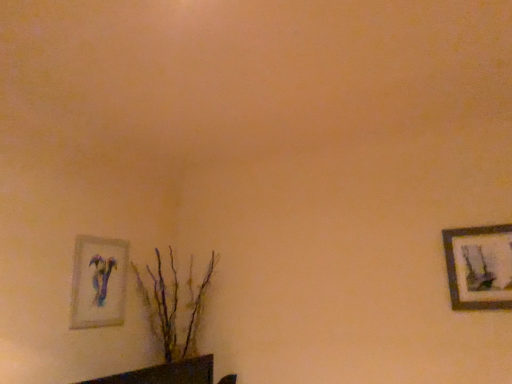
Question: Is the surface of wooden framed artwork at right, which is counted as the first picture frame, starting from the right, in direct contact with brown textured plant at lower left?

Choices:
 (A) yes
 (B) no

Answer: (B)

Question: Considering the relative sizes of wooden framed artwork at right, which is counted as the first picture frame, starting from the right, and brown textured plant at lower left in the image provided, is wooden framed artwork at right, which is counted as the first picture frame, starting from the right, smaller than brown textured plant at lower left?

Choices:
 (A) yes
 (B) no

Answer: (A)

Question: From the image's perspective, does wooden framed artwork at right, which is the 2th picture frame from left to right, appear lower than brown textured plant at lower left?

Choices:
 (A) no
 (B) yes

Answer: (A)

Question: Is wooden framed artwork at right, which is the 2th picture frame from left to right, further to the viewer compared to brown textured plant at lower left?

Choices:
 (A) yes
 (B) no

Answer: (B)

Question: Is wooden framed artwork at right, which is the 2th picture frame from left to right, looking in the opposite direction of brown textured plant at lower left?

Choices:
 (A) yes
 (B) no

Answer: (B)

Question: Is wooden framed artwork at right, which is counted as the first picture frame, starting from the right, far from brown textured plant at lower left?

Choices:
 (A) yes
 (B) no

Answer: (A)

Question: Could you tell me if matte glass picture frame at lower left, the second picture frame viewed from the right, is turned towards brown textured plant at lower left?

Choices:
 (A) no
 (B) yes

Answer: (A)

Question: Considering the relative sizes of matte glass picture frame at lower left, placed as the first picture frame when sorted from left to right, and brown textured plant at lower left in the image provided, is matte glass picture frame at lower left, placed as the first picture frame when sorted from left to right, taller than brown textured plant at lower left?

Choices:
 (A) no
 (B) yes

Answer: (A)

Question: From the image's perspective, is matte glass picture frame at lower left, placed as the first picture frame when sorted from left to right, below brown textured plant at lower left?

Choices:
 (A) yes
 (B) no

Answer: (B)

Question: Is brown textured plant at lower left a part of matte glass picture frame at lower left, the second picture frame viewed from the right?

Choices:
 (A) no
 (B) yes

Answer: (A)

Question: Does matte glass picture frame at lower left, the second picture frame viewed from the right, have a greater width compared to brown textured plant at lower left?

Choices:
 (A) yes
 (B) no

Answer: (B)

Question: Is matte glass picture frame at lower left, placed as the first picture frame when sorted from left to right, bigger than brown textured plant at lower left?

Choices:
 (A) no
 (B) yes

Answer: (A)

Question: Is brown textured plant at lower left further to the viewer compared to matte glass picture frame at lower left, the second picture frame viewed from the right?

Choices:
 (A) yes
 (B) no

Answer: (A)